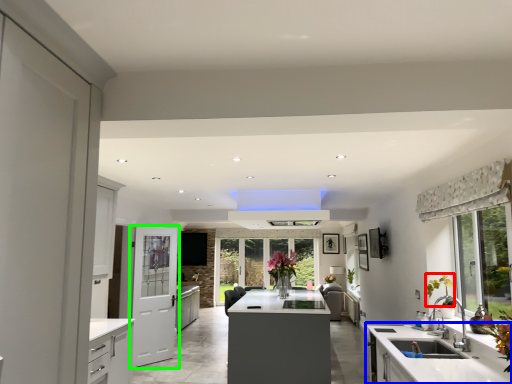
Question: Considering the real-world distances, which object is closest to plant (highlighted by a red box)? countertop (highlighted by a blue box) or door (highlighted by a green box).

Choices:
 (A) countertop
 (B) door

Answer: (A)